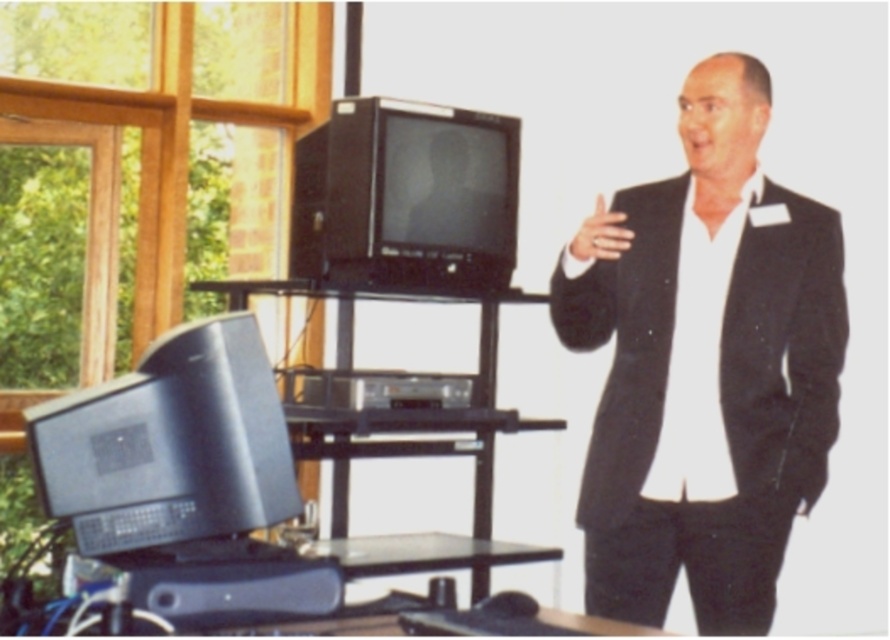
Question: Estimate the real-world distances between objects in this image. Which object is farther from the black plastic television at upper center?

Choices:
 (A) black matte suit at right
 (B) silvery metallic monitor at center

Answer: (A)

Question: Among these points, which one is farthest from the camera?

Choices:
 (A) (431, 147)
 (B) (747, 113)
 (C) (460, 177)

Answer: (C)

Question: Which point is farther from the camera taking this photo?

Choices:
 (A) (498, 218)
 (B) (441, 209)

Answer: (A)

Question: Can you confirm if black matte suit at right is positioned above silvery metallic monitor at center?

Choices:
 (A) no
 (B) yes

Answer: (A)

Question: Considering the relative positions of black matte suit at right and black plastic television at upper center in the image provided, where is black matte suit at right located with respect to black plastic television at upper center?

Choices:
 (A) left
 (B) right

Answer: (B)

Question: Is black matte suit at right above silvery metallic monitor at center?

Choices:
 (A) no
 (B) yes

Answer: (A)